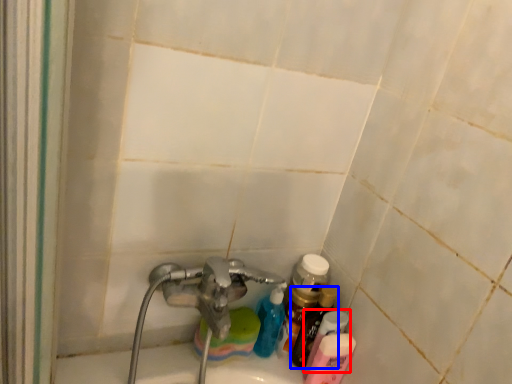
Question: Which of the following is the farthest to the observer, toiletry (highlighted by a red box) or bottle (highlighted by a blue box)?

Choices:
 (A) toiletry
 (B) bottle

Answer: (B)